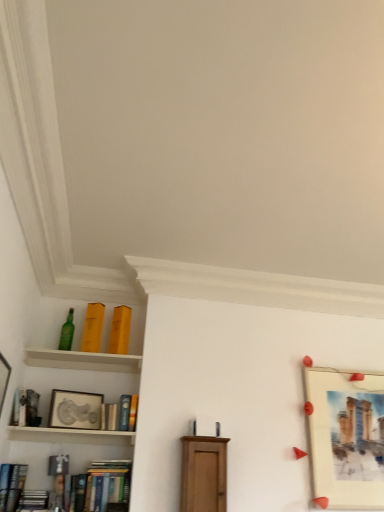
Identify the location of free location in front of matte silver picture frame at upper left, placed as the second picture frame when sorted from right to left. (61, 430).